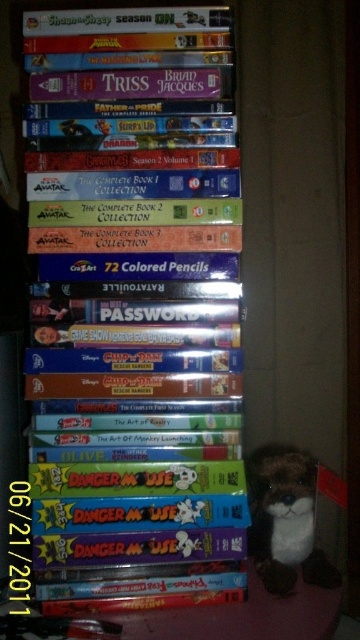
Question: Is hardcover book at center wider than brown plush toy at lower right?

Choices:
 (A) no
 (B) yes

Answer: (B)

Question: Where is hardcover book at center located in relation to brown plush toy at lower right in the image?

Choices:
 (A) left
 (B) right

Answer: (A)

Question: Does hardcover book at center have a greater width compared to brown plush toy at lower right?

Choices:
 (A) no
 (B) yes

Answer: (B)

Question: Which object appears farthest from the camera in this image?

Choices:
 (A) brown plush toy at lower right
 (B) hardcover book at center

Answer: (A)